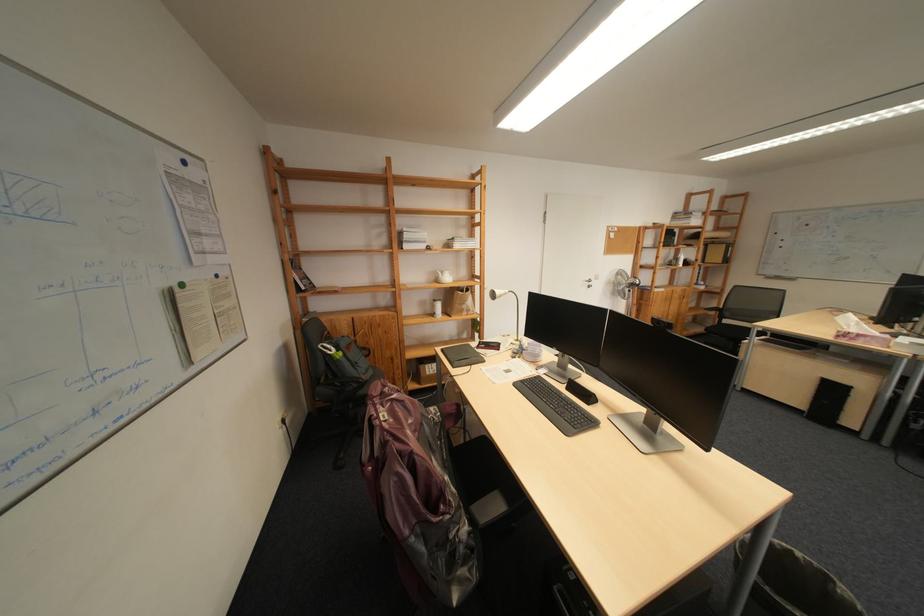
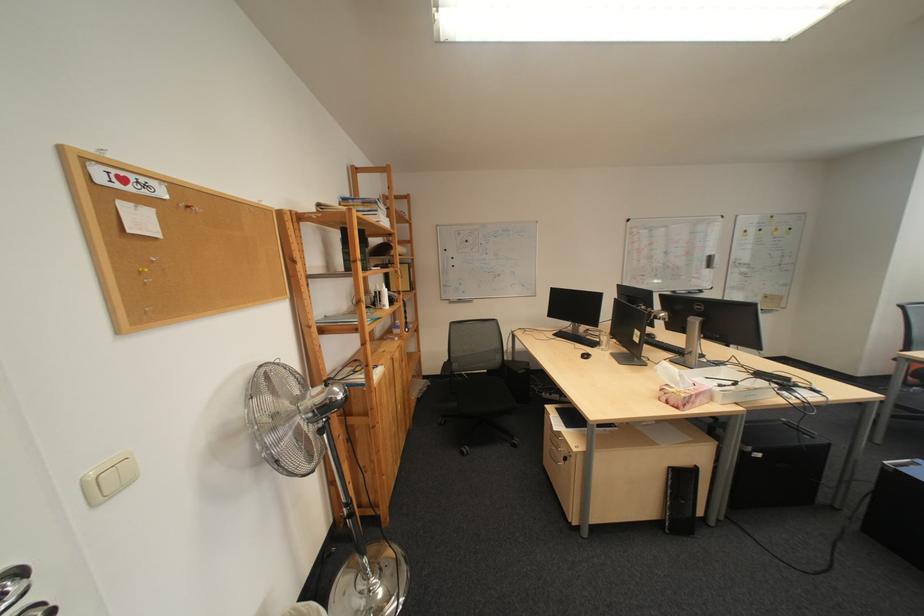
The point at (862, 328) is marked in the first image. Where is the corresponding point in the second image?

(690, 385)